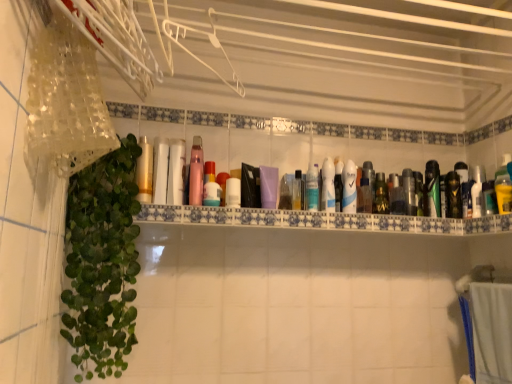
Question: In which direction should I rotate to look at white glossy bottle at center, arranged as the 13th mouthwash when viewed from the right?

Choices:
 (A) left
 (B) right

Answer: (A)

Question: Is green glossy mouthwash at center right, placed as the thirteenth mouthwash when sorted from left to right, inside white plastic hanger at upper center?

Choices:
 (A) no
 (B) yes

Answer: (A)

Question: Is white plastic hanger at upper center at the left side of green glossy mouthwash at center right, placed as the thirteenth mouthwash when sorted from left to right?

Choices:
 (A) no
 (B) yes

Answer: (B)

Question: Is white plastic hanger at upper center positioned beyond the bounds of green glossy mouthwash at center right, placed as the thirteenth mouthwash when sorted from left to right?

Choices:
 (A) no
 (B) yes

Answer: (B)

Question: Is white plastic hanger at upper center positioned far away from green glossy mouthwash at center right, placed as the thirteenth mouthwash when sorted from left to right?

Choices:
 (A) no
 (B) yes

Answer: (A)

Question: Considering the relative sizes of white plastic hanger at upper center and green glossy mouthwash at center right, placed as the thirteenth mouthwash when sorted from left to right, in the image provided, is white plastic hanger at upper center thinner than green glossy mouthwash at center right, placed as the thirteenth mouthwash when sorted from left to right,?

Choices:
 (A) yes
 (B) no

Answer: (B)

Question: From the image's perspective, is white plastic hanger at upper center beneath green glossy mouthwash at center right, placed as the thirteenth mouthwash when sorted from left to right?

Choices:
 (A) yes
 (B) no

Answer: (B)

Question: Is green metallic mouthwash at upper right, the 16th mouthwash from the left, far from matte purple bottle at center, the 7th mouthwash when ordered from left to right?

Choices:
 (A) yes
 (B) no

Answer: (B)

Question: Does green metallic mouthwash at upper right, the 16th mouthwash from the left, turn towards matte purple bottle at center, the 7th mouthwash when ordered from left to right?

Choices:
 (A) no
 (B) yes

Answer: (A)

Question: Is green metallic mouthwash at upper right, the 16th mouthwash from the left, completely or partially outside of matte purple bottle at center, the 7th mouthwash when ordered from left to right?

Choices:
 (A) no
 (B) yes

Answer: (B)

Question: Can you confirm if green metallic mouthwash at upper right, the 16th mouthwash from the left, is thinner than matte purple bottle at center, the 7th mouthwash when ordered from left to right?

Choices:
 (A) no
 (B) yes

Answer: (B)

Question: From a real-world perspective, is green metallic mouthwash at upper right, the 3th mouthwash from the right, below matte purple bottle at center, the 7th mouthwash when ordered from left to right?

Choices:
 (A) no
 (B) yes

Answer: (A)

Question: Is green metallic mouthwash at upper right, the 16th mouthwash from the left, at the left side of matte purple bottle at center, the 7th mouthwash when ordered from left to right?

Choices:
 (A) yes
 (B) no

Answer: (B)

Question: From a real-world perspective, is pink glossy mouthwash at center, which is the sixteenth mouthwash from right to left, located higher than green glossy mouthwash at center right, positioned as the 6th mouthwash in right-to-left order?

Choices:
 (A) yes
 (B) no

Answer: (A)